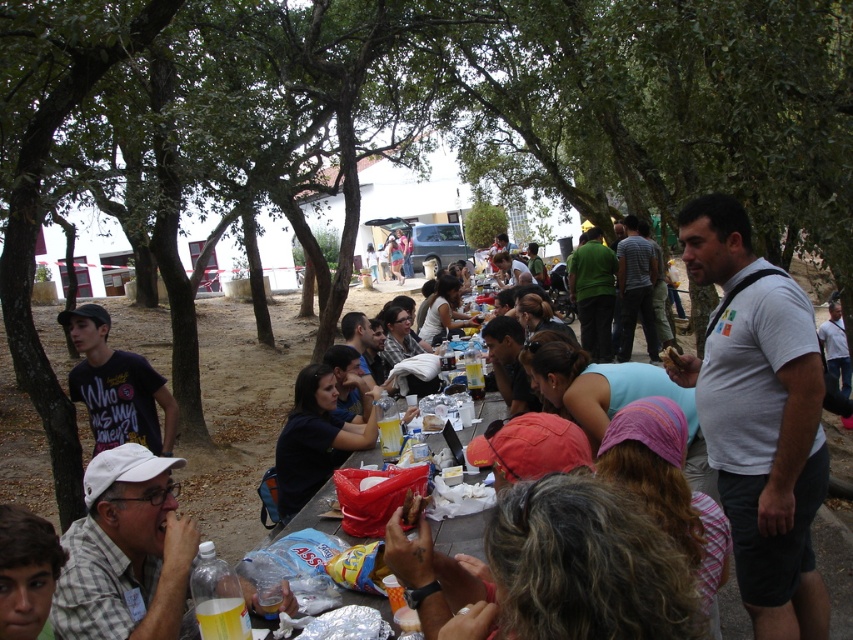
You are at a gathering and want to greet someone with light brown hair at lower left. To reach them, you need to walk around the long table at center. Which direction should you go relative to the white cotton shirt at right?

Since light brown hair at lower left is behind white cotton shirt at right, you should walk around the long table at center towards the left side to reach light brown hair at lower left behind white cotton shirt at right.